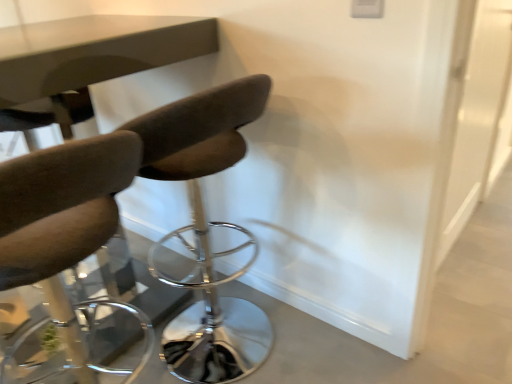
Question: From the image's perspective, is dark brown leather chair at center, the 1th chair from the right, located above or below transparent glass door at right?

Choices:
 (A) above
 (B) below

Answer: (B)

Question: Considering the positions of dark brown leather chair at center, the 1th chair from the right, and transparent glass door at right in the image, is dark brown leather chair at center, the 1th chair from the right, taller or shorter than transparent glass door at right?

Choices:
 (A) short
 (B) tall

Answer: (A)

Question: Which object is the closest to the dark brown leather chair at center, the 1th chair from the right?

Choices:
 (A) transparent glass door at right
 (B) matte brown chair at left, the 1th chair from the left

Answer: (A)

Question: Which is farther from the dark brown leather chair at center, the 1th chair from the right?

Choices:
 (A) transparent glass door at right
 (B) matte brown chair at left, the 1th chair from the left

Answer: (B)